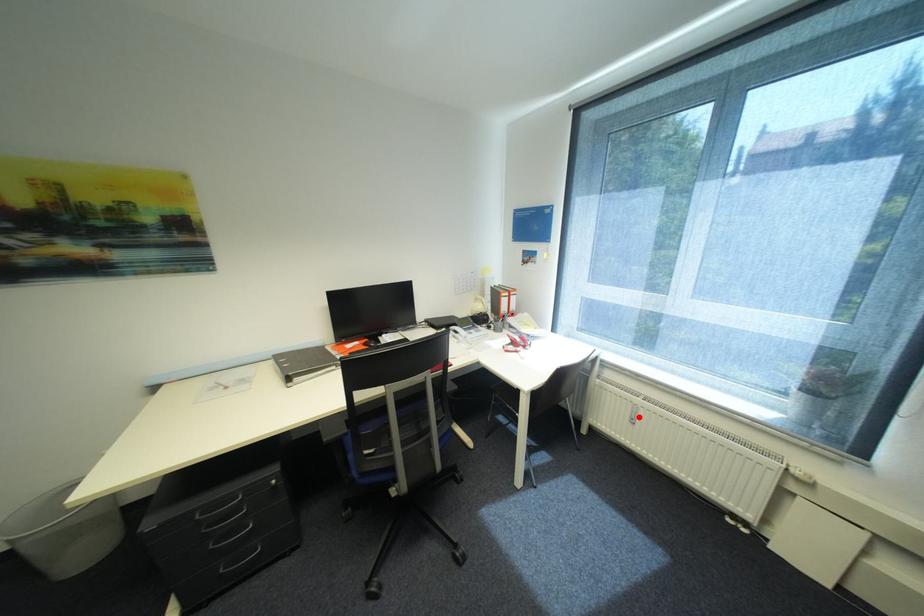
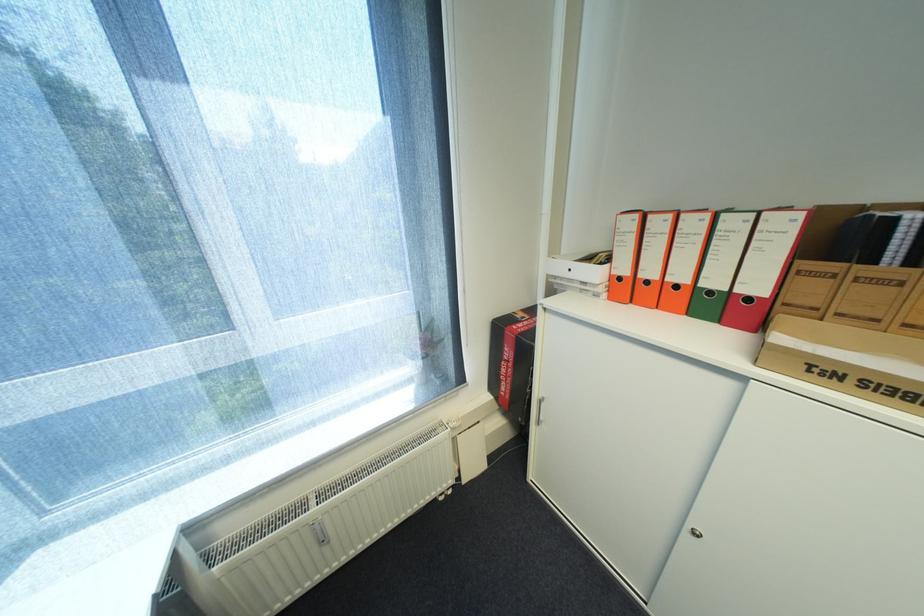
Where in the second image is the point corresponding to the highlighted location from the first image?

(326, 541)